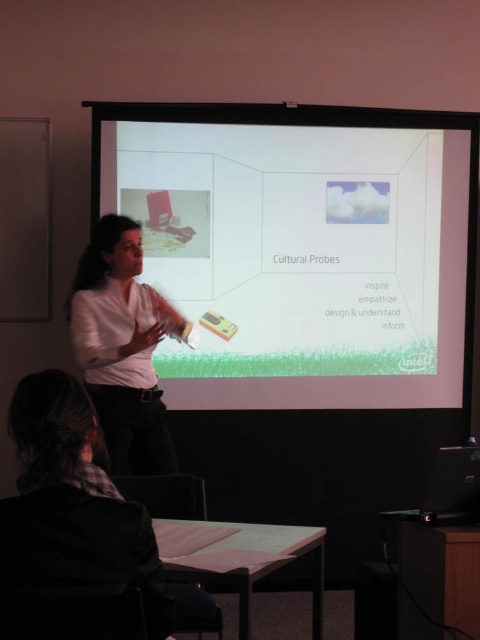
Question: Does white glossy projector screen at upper center lie in front of black fabric jacket at lower left?

Choices:
 (A) no
 (B) yes

Answer: (A)

Question: Can you confirm if white glossy projector screen at upper center is wider than white matte shirt at center?

Choices:
 (A) no
 (B) yes

Answer: (B)

Question: Among these points, which one is farthest from the camera?

Choices:
 (A) (134, 572)
 (B) (108, 296)
 (C) (351, 275)

Answer: (C)

Question: Which of the following is the closest to the observer?

Choices:
 (A) white matte shirt at center
 (B) black fabric jacket at lower left
 (C) white glossy projector screen at upper center

Answer: (B)

Question: Among these objects, which one is nearest to the camera?

Choices:
 (A) white glossy projector screen at upper center
 (B) black fabric jacket at lower left

Answer: (B)

Question: Is white glossy projector screen at upper center bigger than black fabric jacket at lower left?

Choices:
 (A) yes
 (B) no

Answer: (A)